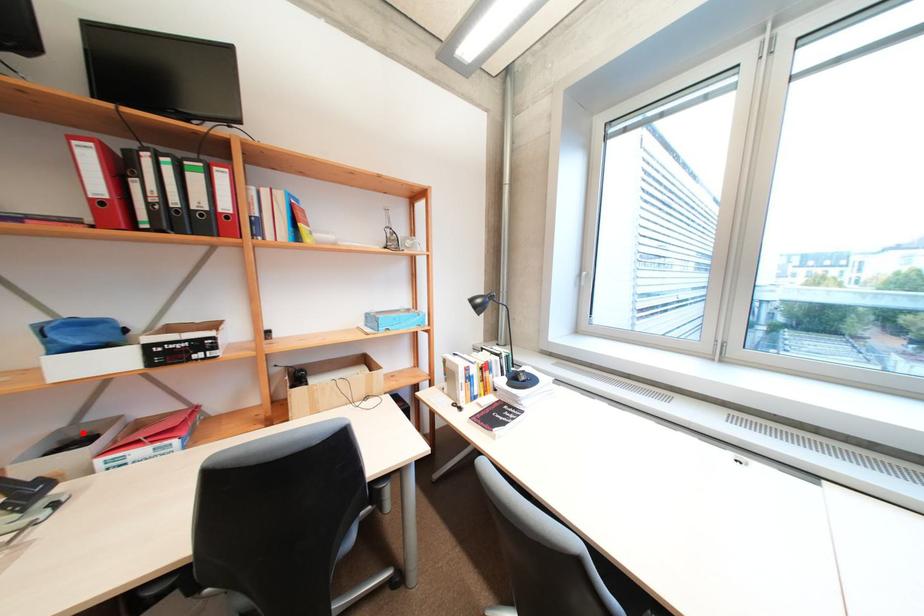
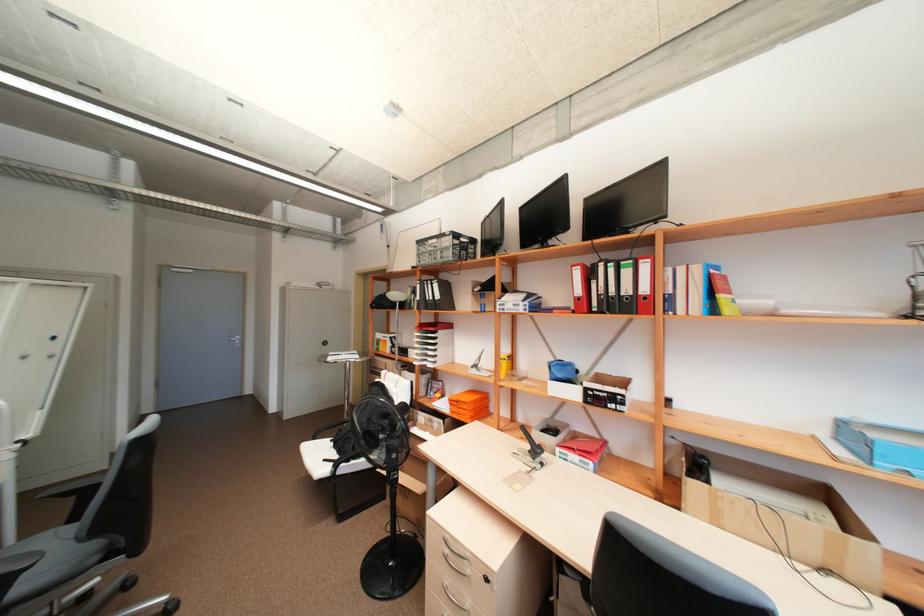
Question: A red point is marked in image1. In image2, is the corresponding 3D point closer to the camera or farther? Reply with the corresponding letter.

Choices:
 (A) The corresponding 3D point is closer.
 (B) The corresponding 3D point is farther.

Answer: (B)